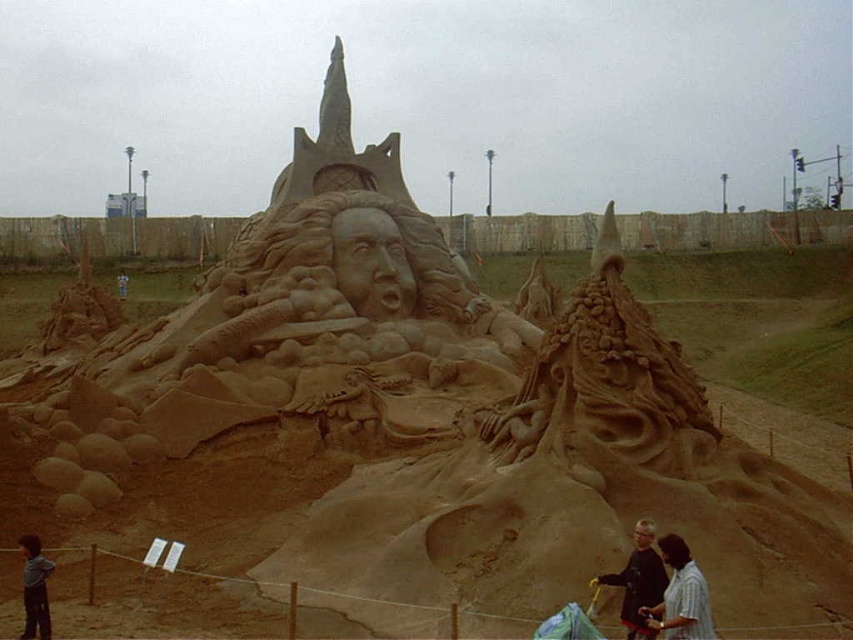
Can you confirm if striped shirt at lower right is positioned to the right of dark gray shirt at lower right?

Yes, striped shirt at lower right is to the right of dark gray shirt at lower right.

Does striped shirt at lower right come behind dark gray shirt at lower right?

Yes.

Which is in front, point (688, 586) or point (643, 618)?

Positioned in front is point (688, 586).

The width and height of the screenshot is (853, 640). I want to click on striped shirt at lower right, so click(x=680, y=595).

Which is more to the left, striped shirt at lower right or dark brown hair at lower left?

dark brown hair at lower left is more to the left.

Who is more forward, (x=695, y=596) or (x=25, y=608)?

Positioned in front is point (x=695, y=596).

The height and width of the screenshot is (640, 853). Identify the location of striped shirt at lower right. (680, 595).

Is the position of striped shirt at lower right more distant than that of blue fabric at center?

Result: No, striped shirt at lower right is closer to the viewer.

Image resolution: width=853 pixels, height=640 pixels. Find the location of `striped shirt at lower right`. striped shirt at lower right is located at coordinates coord(680,595).

Where is `striped shirt at lower right`? striped shirt at lower right is located at coordinates (680, 595).

Where is `striped shirt at lower right`? striped shirt at lower right is located at coordinates (680, 595).